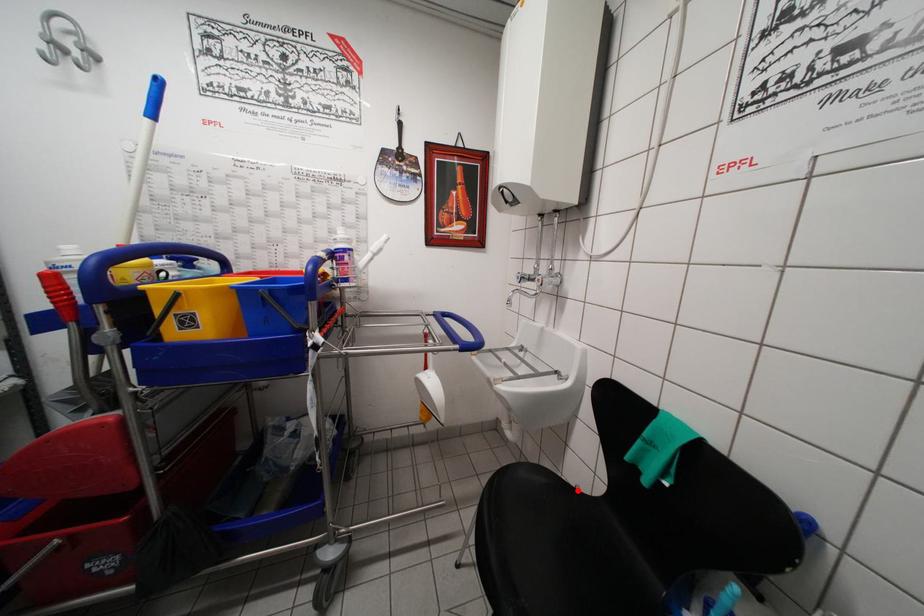
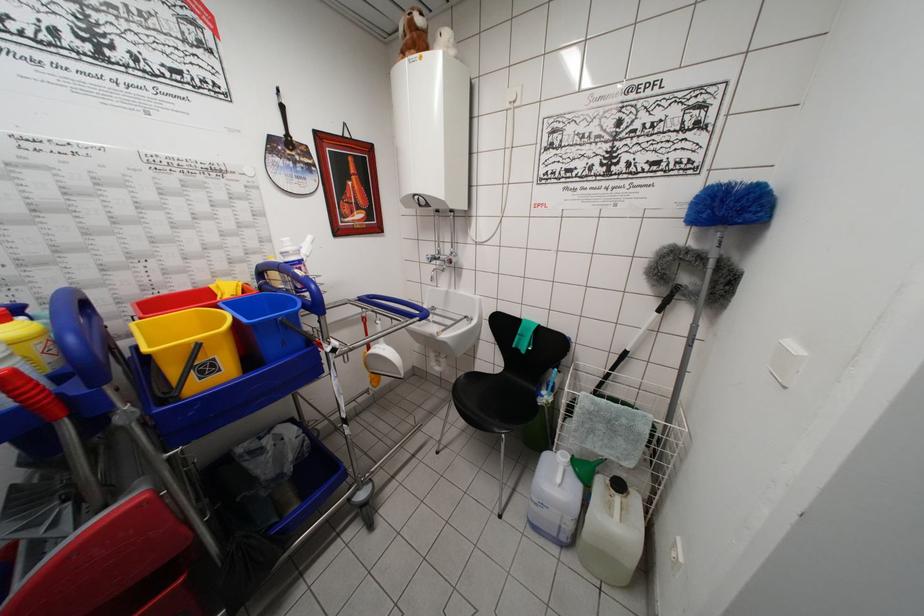
In the second image, find the point that corresponds to the highlighted location in the first image.

(491, 379)